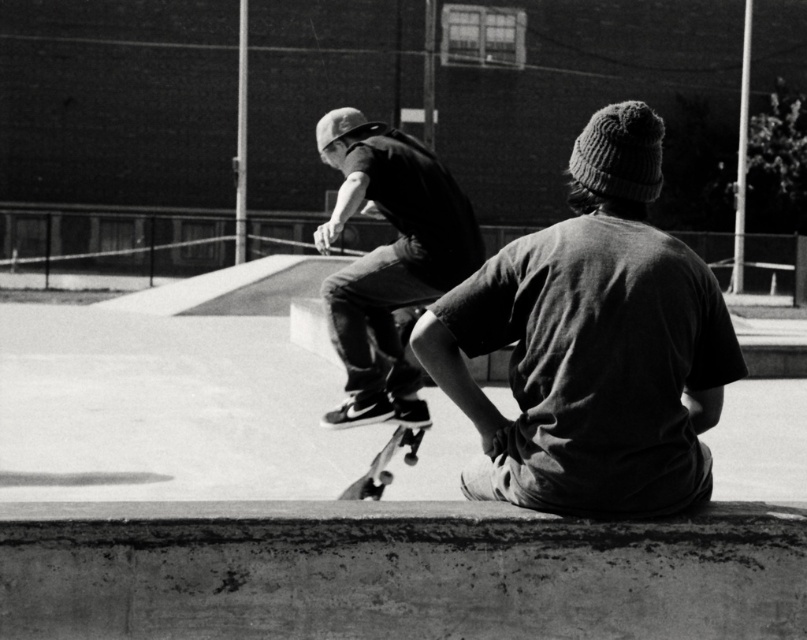
Question: Which object appears farthest from the camera in this image?

Choices:
 (A) matte black skateboard at center
 (B) knit cap at center

Answer: (A)

Question: Is knit cap at center in front of smooth black skateboard at center?

Choices:
 (A) yes
 (B) no

Answer: (A)

Question: Is knit cap at center to the right of matte black skateboard at center from the viewer's perspective?

Choices:
 (A) yes
 (B) no

Answer: (A)

Question: Which point is farther to the camera?

Choices:
 (A) (408, 444)
 (B) (333, 164)

Answer: (A)

Question: Does knit cap at center have a smaller size compared to smooth black skateboard at center?

Choices:
 (A) yes
 (B) no

Answer: (B)

Question: Which of these objects is positioned closest to the smooth black skateboard at center?

Choices:
 (A) matte black skateboard at center
 (B) knit cap at center

Answer: (A)